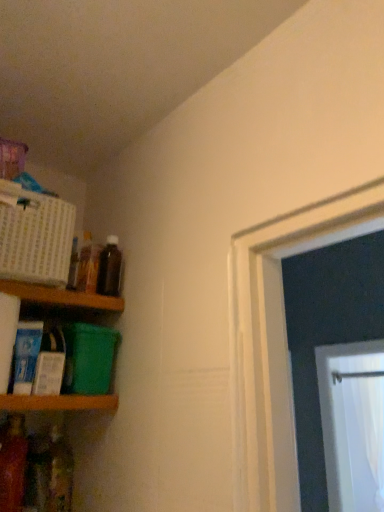
Question: From a real-world perspective, is translucent plastic bottle at lower left, which appears as the 1th bottle when ordered from the bottom, physically below brown glass bottle at upper left, which is the 4th bottle in bottom-to-top order?

Choices:
 (A) no
 (B) yes

Answer: (B)

Question: Considering the relative sizes of translucent plastic bottle at lower left, the 2th bottle from the left, and brown glass bottle at upper left, which is the 4th bottle in bottom-to-top order, in the image provided, is translucent plastic bottle at lower left, the 2th bottle from the left, thinner than brown glass bottle at upper left, which is the 4th bottle in bottom-to-top order,?

Choices:
 (A) no
 (B) yes

Answer: (B)

Question: Is translucent plastic bottle at lower left, the 2th bottle from the left, completely or partially outside of brown glass bottle at upper left, which is the first bottle from top to bottom?

Choices:
 (A) no
 (B) yes

Answer: (B)

Question: Is brown glass bottle at upper left, the 1th bottle when ordered from right to left, a part of translucent plastic bottle at lower left, which appears as the 1th bottle when ordered from the bottom?

Choices:
 (A) yes
 (B) no

Answer: (B)

Question: Is translucent plastic bottle at lower left, which is the third bottle in right-to-left order, bigger than brown glass bottle at upper left, which is the first bottle from top to bottom?

Choices:
 (A) no
 (B) yes

Answer: (B)

Question: Is translucent plastic bottle at lower left, placed as the fourth bottle when sorted from top to bottom, to the left or to the right of wooden shelf at left, which is counted as the 1th shelf, starting from the top, in the image?

Choices:
 (A) right
 (B) left

Answer: (A)

Question: Is point (59, 438) positioned closer to the camera than point (46, 287)?

Choices:
 (A) closer
 (B) farther

Answer: (B)

Question: Considering the positions of translucent plastic bottle at lower left, which is the third bottle in right-to-left order, and wooden shelf at left, placed as the second shelf when sorted from bottom to top, in the image, is translucent plastic bottle at lower left, which is the third bottle in right-to-left order, wider or thinner than wooden shelf at left, placed as the second shelf when sorted from bottom to top,?

Choices:
 (A) thin
 (B) wide

Answer: (A)

Question: Is translucent plastic bottle at lower left, which is the third bottle in right-to-left order, taller or shorter than wooden shelf at left, placed as the second shelf when sorted from bottom to top?

Choices:
 (A) short
 (B) tall

Answer: (B)

Question: Is brown glass bottle at upper left, which is the 4th bottle in bottom-to-top order, in front of or behind translucent plastic bottle at lower left, which is the 1th bottle in left-to-right order, in the image?

Choices:
 (A) behind
 (B) front

Answer: (A)

Question: Choose the correct answer: Is brown glass bottle at upper left, which is the fourth bottle from left to right, inside translucent plastic bottle at lower left, which is the 2th bottle in bottom-to-top order, or outside it?

Choices:
 (A) outside
 (B) inside

Answer: (A)

Question: Is brown glass bottle at upper left, which is the 4th bottle in bottom-to-top order, bigger or smaller than translucent plastic bottle at lower left, placed as the 3th bottle when sorted from top to bottom?

Choices:
 (A) big
 (B) small

Answer: (B)

Question: Is point (110, 266) closer or farther from the camera than point (16, 476)?

Choices:
 (A) farther
 (B) closer

Answer: (A)

Question: From the image's perspective, relative to translucent plastic bottle at lower left, placed as the 3th bottle when sorted from top to bottom, is wooden shelf at lower left, placed as the 1th shelf when sorted from bottom to top, above or below?

Choices:
 (A) above
 (B) below

Answer: (A)

Question: Is wooden shelf at lower left, arranged as the second shelf when viewed from the top, wider or thinner than translucent plastic bottle at lower left, arranged as the fourth bottle when viewed from the right?

Choices:
 (A) wide
 (B) thin

Answer: (A)